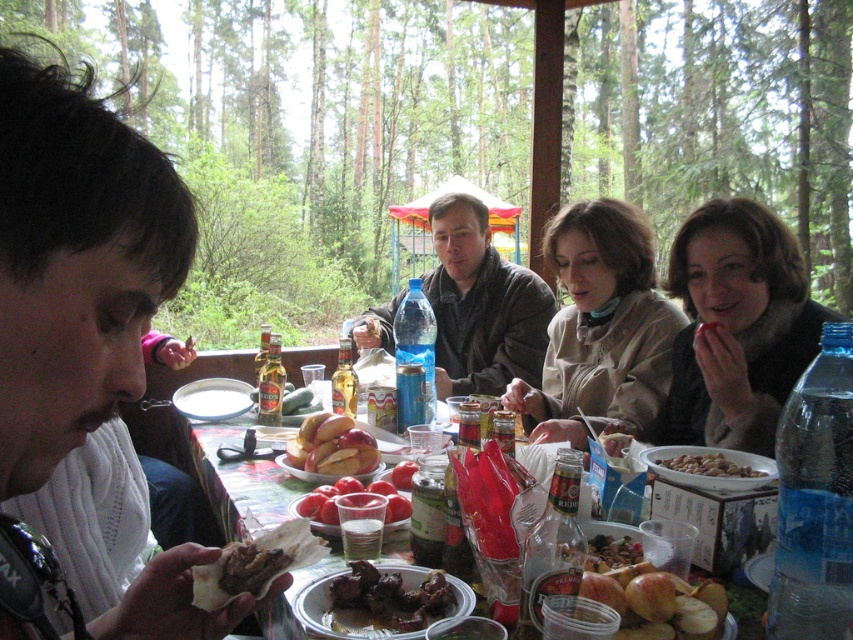
Question: Does shiny golden apples at center have a smaller size compared to shiny plastic container at center?

Choices:
 (A) yes
 (B) no

Answer: (B)

Question: Which object is farther from the camera taking this photo?

Choices:
 (A) brown crispy meat at lower left
 (B) shiny golden apples at center
 (C) wooden table at center
 (D) tomato paste at center

Answer: (B)

Question: Is the position of brown woolen sweater at upper right more distant than that of shiny plastic container at center?

Choices:
 (A) yes
 (B) no

Answer: (A)

Question: Is tomato paste at center positioned at the back of brown matte nuts at center?

Choices:
 (A) no
 (B) yes

Answer: (B)

Question: Which object appears closest to the camera in this image?

Choices:
 (A) shiny red apples at lower right
 (B) shiny golden apples at center

Answer: (A)

Question: Which point appears closest to the camera in this image?

Choices:
 (A) (289, 570)
 (B) (637, 564)
 (C) (357, 586)

Answer: (A)